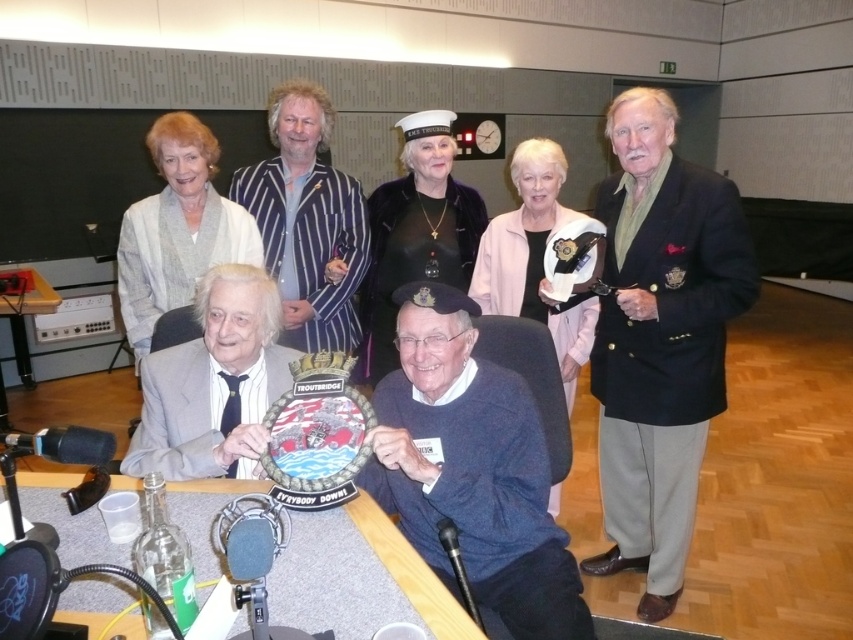
You are a photographer standing at the back of the studio. You need to take a photo of the gray fabric suit at lower left and the wooden table at lower left. Can you fit both in your camera frame if your camera has a minimum distance requirement of 8 feet between subjects to capture them clearly?

The distance between the gray fabric suit at lower left and the wooden table at lower left is 7.65 feet. Since this is less than the 8 feet requirement, the camera cannot clearly capture both in the same frame.